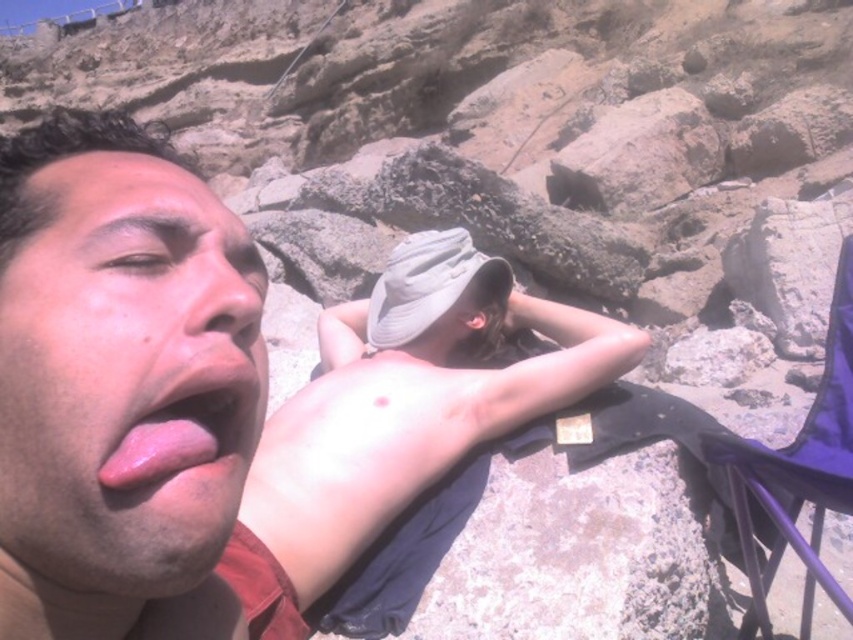
Can you confirm if purple fabric chair at lower right is smaller than pink glossy lips at center?

Actually, purple fabric chair at lower right might be larger than pink glossy lips at center.

Who is more distant from viewer, [851,394] or [192,436]?

Point [851,394]

Where is `purple fabric chair at lower right`? The image size is (853, 640). purple fabric chair at lower right is located at coordinates (798, 472).

Is smooth tan skin at center wider than pink glossy lips at center?

No.

Which is below, smooth tan skin at center or pink glossy lips at center?

smooth tan skin at center is below.

Is point (476, 416) closer to camera compared to point (204, 401)?

No, (476, 416) is behind (204, 401).

The width and height of the screenshot is (853, 640). Find the location of `smooth tan skin at center`. smooth tan skin at center is located at coordinates (410, 401).

Is smooth skin face at left in front of purple fabric chair at lower right?

Yes, smooth skin face at left is closer to the viewer.

Which is more to the right, smooth skin face at left or purple fabric chair at lower right?

From the viewer's perspective, purple fabric chair at lower right appears more on the right side.

Is point (215, 484) less distant than point (701, 440)?

That is True.

Find the location of a particular element. smooth skin face at left is located at coordinates (120, 385).